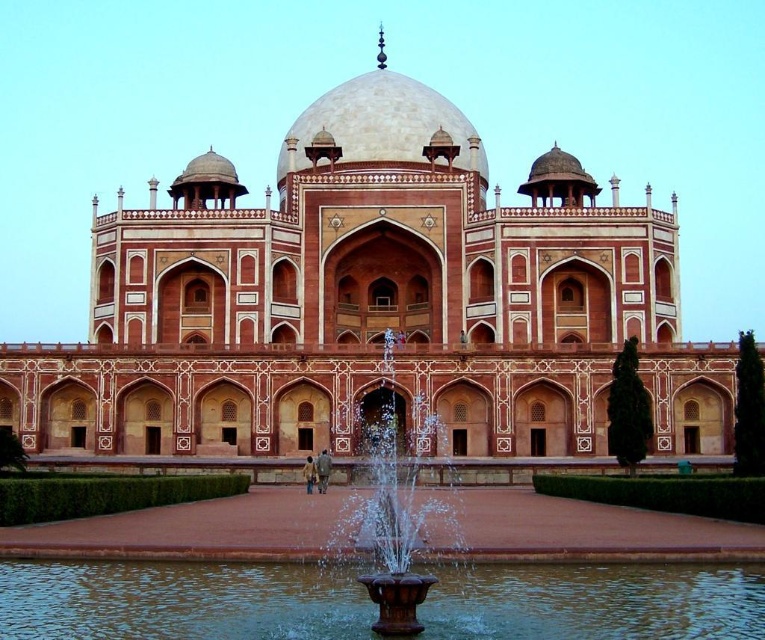
Who is more distant from viewer, [212,301] or [401,589]?

Point [212,301]

Is point (277, 387) positioned before point (347, 538)?

No, it is behind (347, 538).

Does point (414, 330) come closer to viewer compared to point (376, 560)?

No.

The width and height of the screenshot is (765, 640). I want to click on reddish-brown stone palace at center, so click(x=373, y=304).

Measure the distance from brown water at center to brown stone fountain at center.

They are 8.12 meters apart.

Looking at this image, who is more forward, (451, 628) or (383, 349)?

Positioned in front is point (451, 628).

Measure the distance between point (467, 628) and camera.

The distance of point (467, 628) from camera is 28.14 meters.

Where is `brown water at center`? The image size is (765, 640). brown water at center is located at coordinates (181, 602).

Does reddish-brown stone palace at center have a lesser width compared to brown water at center?

In fact, reddish-brown stone palace at center might be wider than brown water at center.

Between point (542, 202) and point (308, 602), which one is positioned behind?

Positioned behind is point (542, 202).

Where is `reddish-brown stone palace at center`? reddish-brown stone palace at center is located at coordinates (373, 304).

The width and height of the screenshot is (765, 640). In order to click on reddish-brown stone palace at center in this screenshot , I will do `click(373, 304)`.